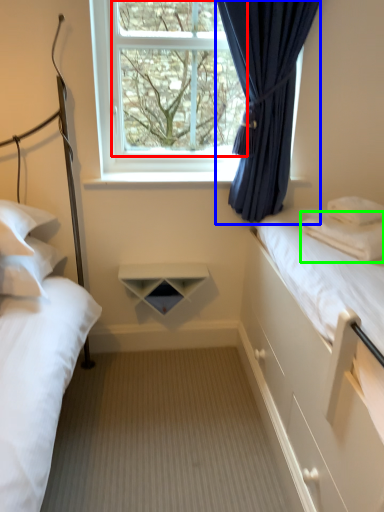
Question: Based on their relative distances, which object is nearer to window screen (highlighted by a red box)? Choose from curtain (highlighted by a blue box) and pillow (highlighted by a green box).

Choices:
 (A) curtain
 (B) pillow

Answer: (A)